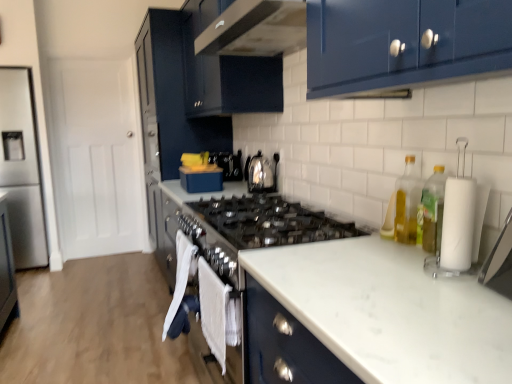
Where is `blank space above white marble countertop at center (from a real-world perspective)`? The width and height of the screenshot is (512, 384). blank space above white marble countertop at center (from a real-world perspective) is located at coordinates (x=390, y=297).